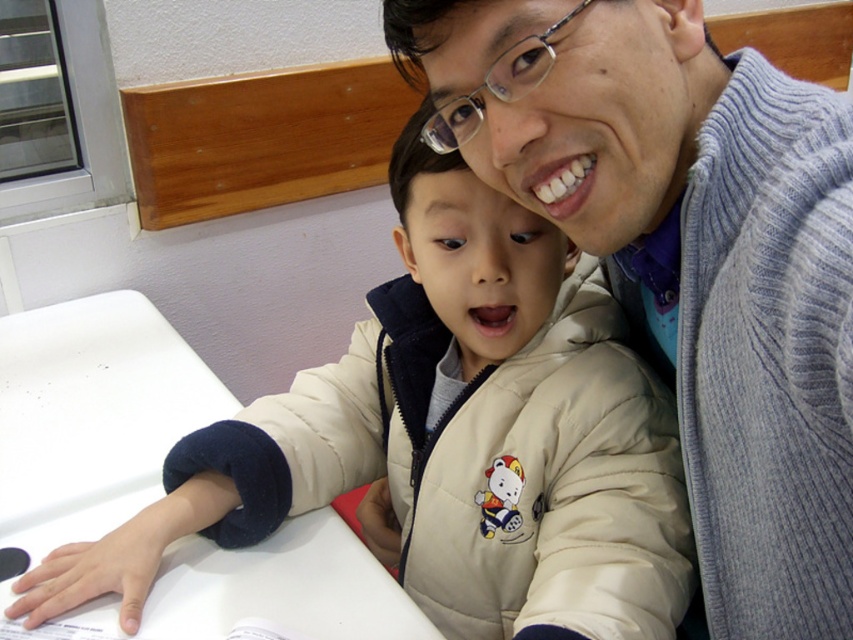
You are a GUI agent. You are given a task and a screenshot of the screen. Output one action in this format:
    pyautogui.click(x=<x>, y=<y>)
    Task: Click on the gray knit sweater at upper right
    The width and height of the screenshot is (853, 640).
    Given the screenshot: What is the action you would take?
    pyautogui.click(x=688, y=257)

Does point (834, 305) lie behind point (113, 380)?

No, it is not.

In order to click on gray knit sweater at upper right in this screenshot , I will do `click(688, 257)`.

Consider the image. Which of these two, beige quilted jacket at center or white matte table at lower left, stands taller?

With more height is beige quilted jacket at center.

Who is lower down, beige quilted jacket at center or white matte table at lower left?

white matte table at lower left is lower down.

Does point (525, 608) come in front of point (51, 388)?

That is True.

Find the location of a particular element. The image size is (853, 640). beige quilted jacket at center is located at coordinates (450, 440).

Does gray knit sweater at upper right appear under beige quilted jacket at center?

No.

Is gray knit sweater at upper right thinner than beige quilted jacket at center?

Correct, gray knit sweater at upper right's width is less than beige quilted jacket at center's.

Identify the location of gray knit sweater at upper right. (688, 257).